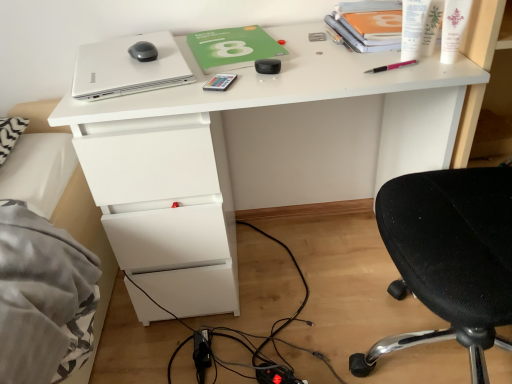
Find the location of `free space in front of green matte notebook at center`. free space in front of green matte notebook at center is located at coordinates (248, 84).